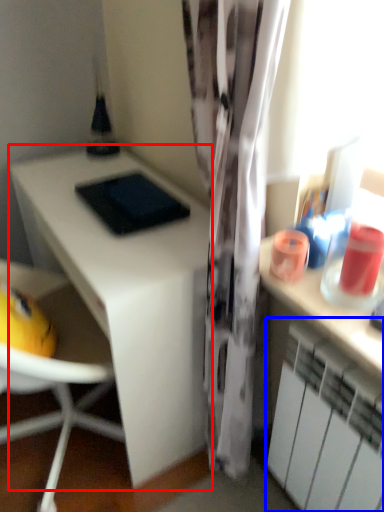
Question: Among these objects, which one is nearest to the camera, desk (highlighted by a red box) or cabinetry (highlighted by a blue box)?

Choices:
 (A) desk
 (B) cabinetry

Answer: (B)